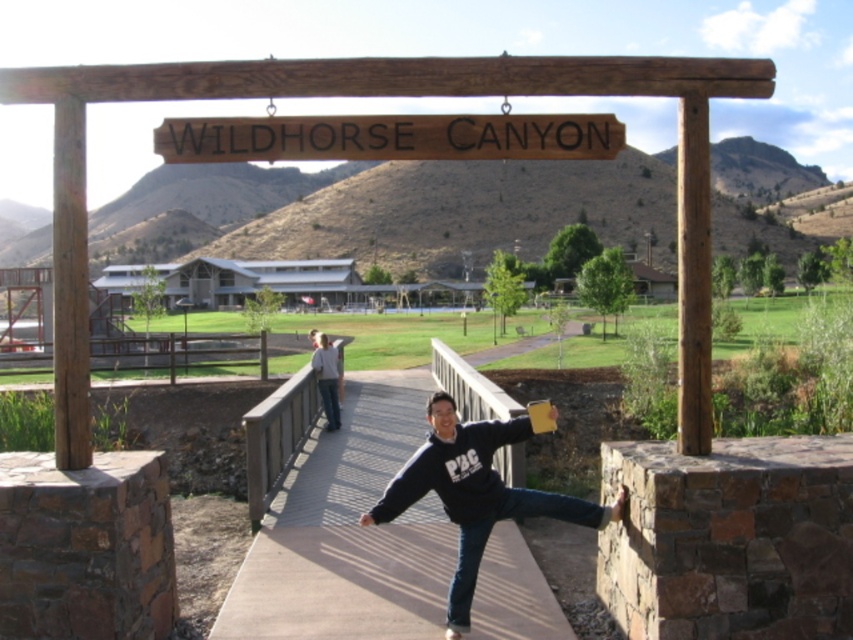
Which is more to the right, black fleece at center or light gray sweater at center?

black fleece at center

Can you confirm if black fleece at center is positioned to the left of light gray sweater at center?

In fact, black fleece at center is to the right of light gray sweater at center.

Identify the location of black fleece at center. This screenshot has width=853, height=640. pyautogui.click(x=474, y=493).

Describe the element at coordinates (347, 532) in the screenshot. This screenshot has width=853, height=640. I see `concrete bridge at center` at that location.

Identify the location of concrete bridge at center. This screenshot has height=640, width=853. (347, 532).

Is the position of brown wooden sign at center more distant than that of black fleece at center?

Yes, it is.

Is point (404, 134) positioned before point (451, 600)?

No, (404, 134) is further to viewer.

Locate an element on the screen. This screenshot has width=853, height=640. brown wooden sign at center is located at coordinates (389, 138).

I want to click on brown wooden sign at center, so tap(389, 138).